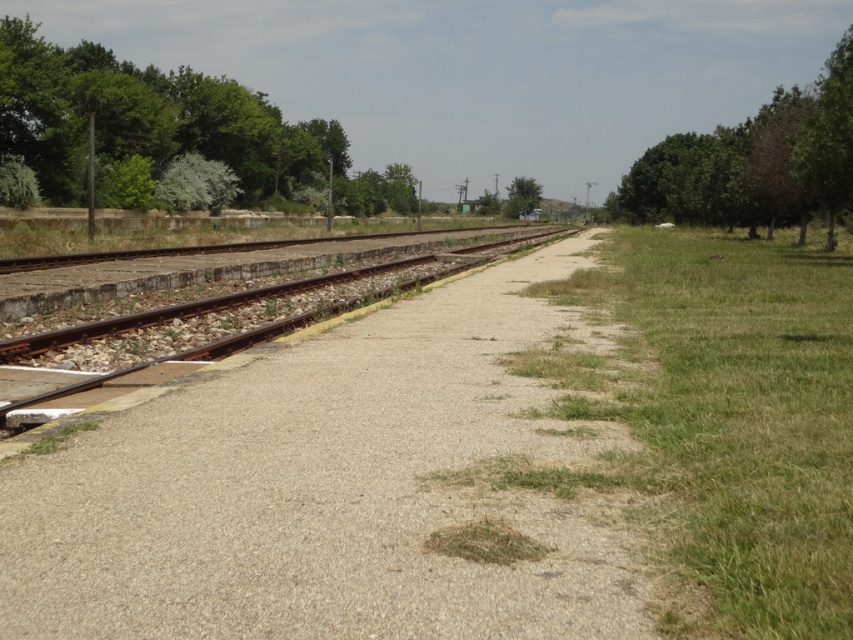
Question: Which point is farther to the camera?

Choices:
 (A) (241, 198)
 (B) (525, 205)
 (C) (270, 392)

Answer: (B)

Question: Does gray concrete path at center appear over green grass at right?

Choices:
 (A) yes
 (B) no

Answer: (B)

Question: Which object is closer to the camera taking this photo?

Choices:
 (A) gray concrete path at center
 (B) rusty metal train track at center
 (C) green grass at right

Answer: (C)

Question: Where is green leafy tree at left located in relation to green leafy tree at upper right in the image?

Choices:
 (A) below
 (B) above

Answer: (B)

Question: Which of the following is the farthest from the observer?

Choices:
 (A) rusty metal train track at center
 (B) gray concrete path at center

Answer: (A)

Question: Observing the image, what is the correct spatial positioning of green leafy tree at left in reference to green leafy tree at center?

Choices:
 (A) above
 (B) below

Answer: (A)